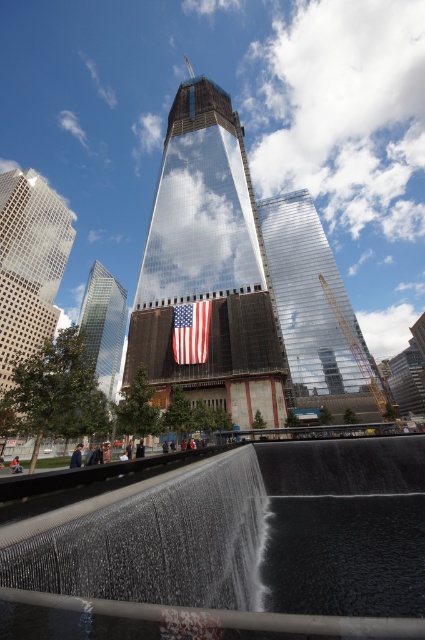
Between reflective glass skyscraper at center and shiny glass skyscraper at center, which one has more height?

reflective glass skyscraper at center is taller.

Who is more distant from viewer, [173,177] or [263,205]?

Point [263,205]

Image resolution: width=425 pixels, height=640 pixels. Describe the element at coordinates (207, 262) in the screenshot. I see `reflective glass skyscraper at center` at that location.

You are a GUI agent. You are given a task and a screenshot of the screen. Output one action in this format:
    pyautogui.click(x=<x>, y=<y>)
    Task: Click on the reflective glass skyscraper at center
    Image resolution: width=425 pixels, height=640 pixels.
    Given the screenshot: What is the action you would take?
    pyautogui.click(x=207, y=262)

Does black smooth water at lower center have a greater width compared to reflective glass skyscraper at center?

In fact, black smooth water at lower center might be narrower than reflective glass skyscraper at center.

Which is above, black smooth water at lower center or reflective glass skyscraper at center?

Positioned higher is reflective glass skyscraper at center.

Image resolution: width=425 pixels, height=640 pixels. I want to click on black smooth water at lower center, so click(x=232, y=548).

Can you confirm if black smooth water at lower center is bigger than shiny glass skyscraper at center?

Incorrect, black smooth water at lower center is not larger than shiny glass skyscraper at center.

Consider the image. Is black smooth water at lower center wider than shiny glass skyscraper at center?

No.

Which is in front, point (161, 499) or point (291, 332)?

Point (161, 499) is more forward.

Where is `black smooth water at lower center`? The height and width of the screenshot is (640, 425). black smooth water at lower center is located at coordinates (232, 548).